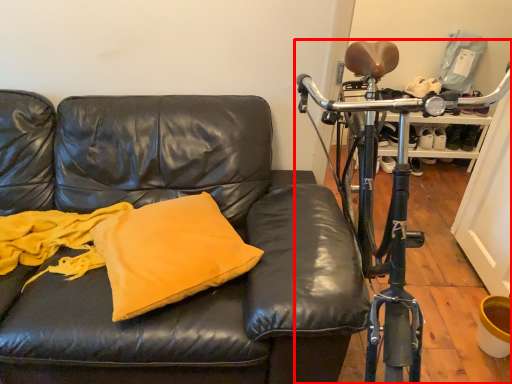
Question: Where is bicycle (annotated by the red box) located in relation to pillow in the image?

Choices:
 (A) right
 (B) left

Answer: (A)